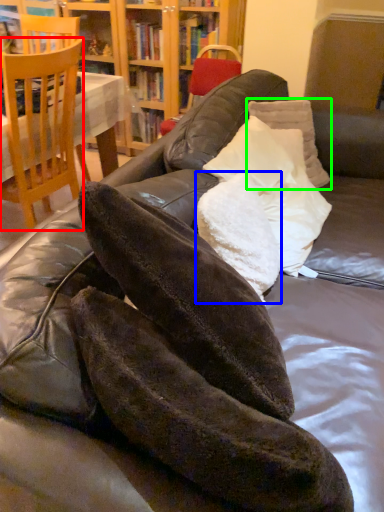
Question: Considering the real-world distances, which object is closest to chair (highlighted by a red box)? pillow (highlighted by a blue box) or pillow (highlighted by a green box).

Choices:
 (A) pillow
 (B) pillow

Answer: (B)